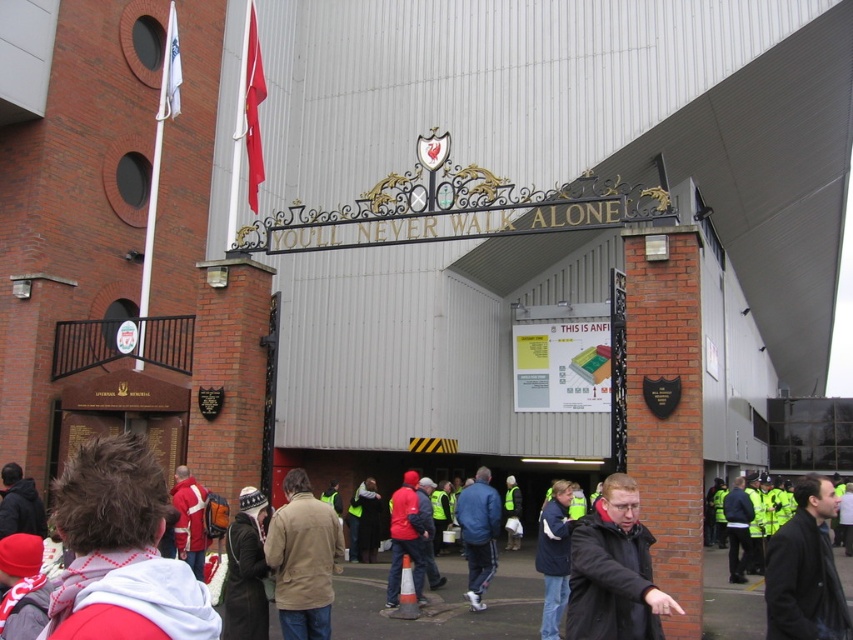
Question: Which point is farther to the camera?

Choices:
 (A) yellow reflective vest at center
 (B) dark brown leather jacket at center
 (C) dark brown leather jacket at lower left

Answer: (A)

Question: Is beige fabric jacket at center to the right of red fabric jacket at center from the viewer's perspective?

Choices:
 (A) no
 (B) yes

Answer: (B)

Question: Does dark brown leather jacket at lower left have a greater width compared to red knit cap at upper left?

Choices:
 (A) yes
 (B) no

Answer: (A)

Question: Which of the following is the closest to the observer?

Choices:
 (A) (798, 573)
 (B) (192, 515)

Answer: (A)

Question: Which of the following is the farthest from the observer?

Choices:
 (A) (807, 504)
 (B) (364, 532)
 (C) (567, 548)

Answer: (B)

Question: Does dark blue jacket at center have a larger size compared to red knit cap at upper left?

Choices:
 (A) yes
 (B) no

Answer: (A)